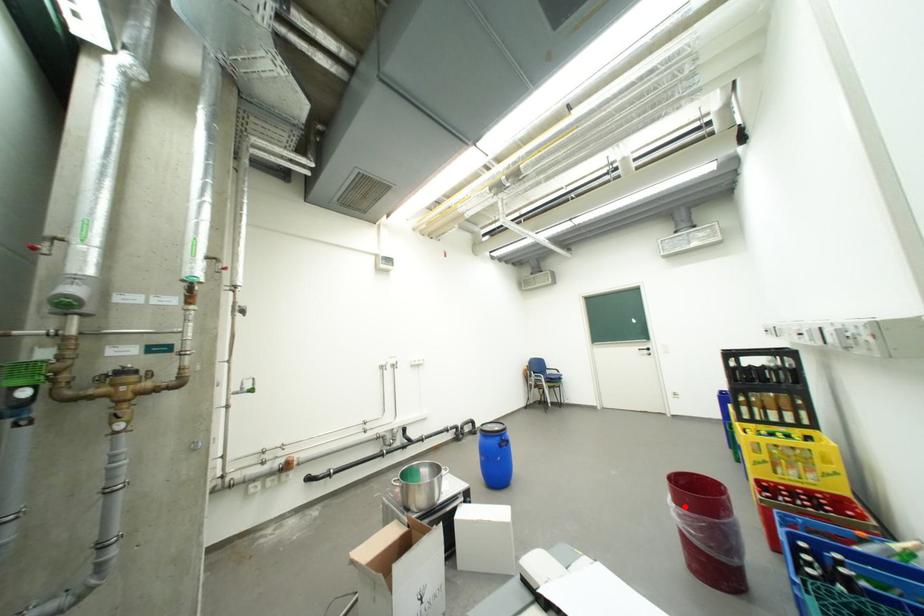
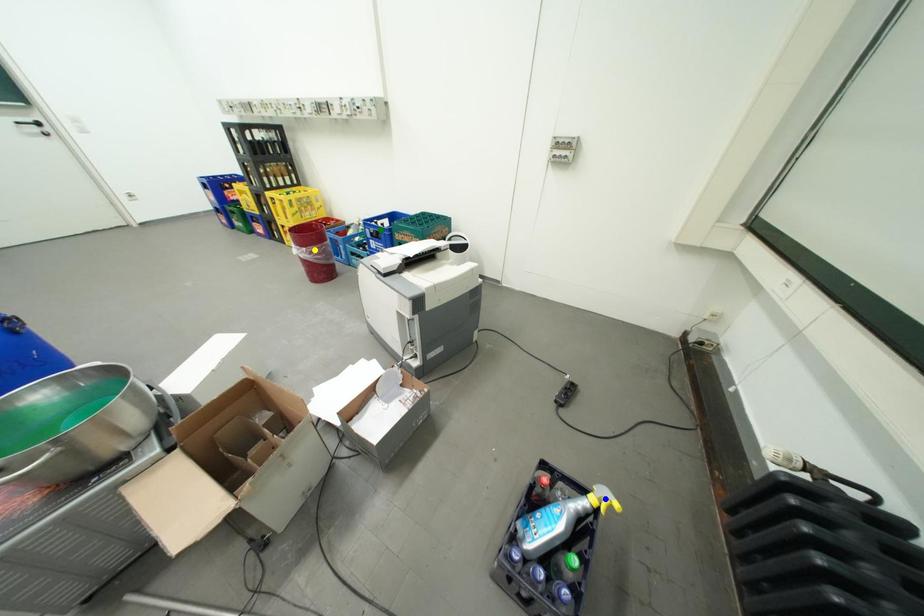
Question: I am providing you with two images of the same scene from different viewpoints. A red point is marked on the first image. You are given multiple points on the second image. Which point in image 2 represents the same 3d spot as the red point in image 1?

Choices:
 (A) yellow point
 (B) blue point
 (C) green point

Answer: (A)